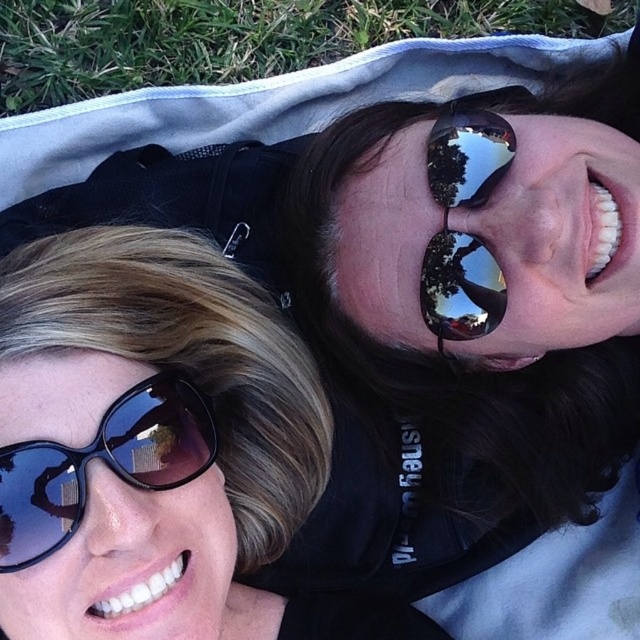
Consider the image. You are a photographer holding a camera and want to capture a closeup shot of the matte black sunglasses at upper left. The recommended distance for this shot is 30 inches. Can you take the photo from your current position?

The matte black sunglasses at upper left and camera are 30.33 inches apart, which is slightly more than the recommended 30 inches. To achieve the desired closeup, you should move 0.33 inches closer to the matte black sunglasses at upper left.

You are a photographer who just took a picture of two people on a light blue blanket. You want to place a matte black sunglasses at upper left in the image. Where should you place it?

The matte black sunglasses at upper left should be placed at point [157,448].